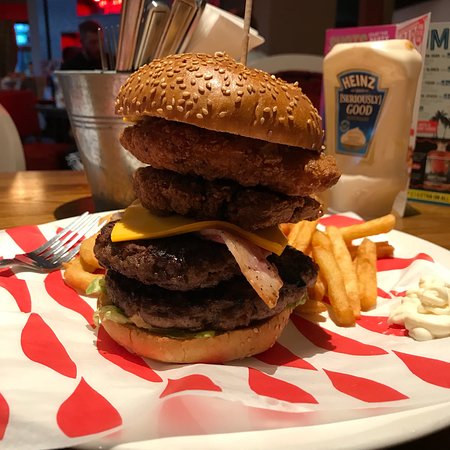
Where is `table`? table is located at coordinates (38, 180), (426, 218).